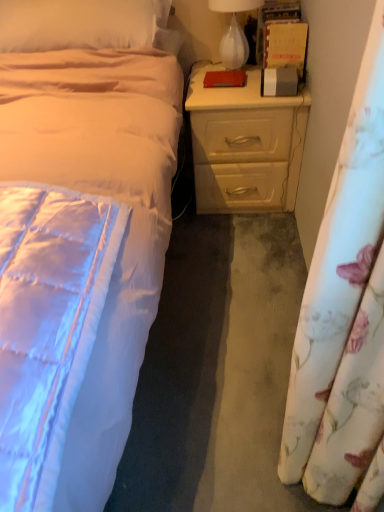
At what (x,y) coordinates should I click in order to perform the action: click on empty space that is in between floral fabric curtain at right and beige wood nightstand at right. Please return your answer as a coordinate pair (x, y). Looking at the image, I should click on (245, 293).